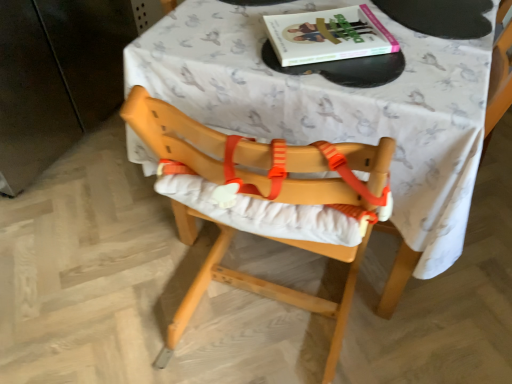
Question: Is hardcover book at upper center not within natural wood highchair at center?

Choices:
 (A) no
 (B) yes

Answer: (A)

Question: Is hardcover book at upper center positioned before natural wood highchair at center?

Choices:
 (A) no
 (B) yes

Answer: (A)

Question: From the image's perspective, is hardcover book at upper center beneath natural wood highchair at center?

Choices:
 (A) no
 (B) yes

Answer: (A)

Question: Does hardcover book at upper center have a lesser height compared to natural wood highchair at center?

Choices:
 (A) yes
 (B) no

Answer: (A)

Question: Is hardcover book at upper center placed right next to natural wood highchair at center?

Choices:
 (A) no
 (B) yes

Answer: (A)

Question: Considering the positions of natural wood highchair at center and white fabric-covered table at center in the image, is natural wood highchair at center wider or thinner than white fabric-covered table at center?

Choices:
 (A) thin
 (B) wide

Answer: (A)

Question: Is natural wood highchair at center inside or outside of white fabric-covered table at center?

Choices:
 (A) inside
 (B) outside

Answer: (A)

Question: Considering the positions of point (392, 228) and point (470, 157), is point (392, 228) closer or farther from the camera than point (470, 157)?

Choices:
 (A) farther
 (B) closer

Answer: (A)

Question: From the image's perspective, is natural wood highchair at center above or below white fabric-covered table at center?

Choices:
 (A) above
 (B) below

Answer: (B)

Question: From the image's perspective, is hardcover book at upper center above or below natural wood highchair at center?

Choices:
 (A) above
 (B) below

Answer: (A)

Question: Is hardcover book at upper center inside the boundaries of natural wood highchair at center, or outside?

Choices:
 (A) inside
 (B) outside

Answer: (A)

Question: Is hardcover book at upper center in front of or behind natural wood highchair at center in the image?

Choices:
 (A) behind
 (B) front

Answer: (A)

Question: Is hardcover book at upper center to the left or to the right of natural wood highchair at center in the image?

Choices:
 (A) right
 (B) left

Answer: (A)

Question: Based on their positions, is white fabric-covered table at center located to the left or right of natural wood highchair at center?

Choices:
 (A) left
 (B) right

Answer: (B)

Question: Considering the positions of white fabric-covered table at center and natural wood highchair at center in the image, is white fabric-covered table at center bigger or smaller than natural wood highchair at center?

Choices:
 (A) big
 (B) small

Answer: (A)